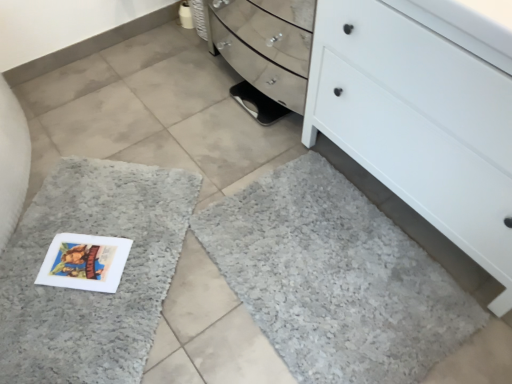
Question: Considering the relative sizes of black rubber shoe at center and gray shaggy bath mat at lower left, marked as the first bath mat in a left-to-right arrangement, in the image provided, is black rubber shoe at center taller than gray shaggy bath mat at lower left, marked as the first bath mat in a left-to-right arrangement,?

Choices:
 (A) no
 (B) yes

Answer: (A)

Question: Does black rubber shoe at center appear on the left side of gray shaggy bath mat at lower left, which is the second bath mat from right to left?

Choices:
 (A) no
 (B) yes

Answer: (A)

Question: Does black rubber shoe at center have a smaller size compared to gray shaggy bath mat at lower left, marked as the first bath mat in a left-to-right arrangement?

Choices:
 (A) no
 (B) yes

Answer: (B)

Question: Is black rubber shoe at center oriented towards gray shaggy bath mat at lower left, marked as the first bath mat in a left-to-right arrangement?

Choices:
 (A) yes
 (B) no

Answer: (A)

Question: Are black rubber shoe at center and gray shaggy bath mat at lower left, marked as the first bath mat in a left-to-right arrangement, making contact?

Choices:
 (A) yes
 (B) no

Answer: (B)

Question: Can we say black rubber shoe at center lies outside gray shaggy bath mat at lower left, marked as the first bath mat in a left-to-right arrangement?

Choices:
 (A) no
 (B) yes

Answer: (B)

Question: Is black rubber shoe at center far from white matte chest of drawers at lower right?

Choices:
 (A) yes
 (B) no

Answer: (B)

Question: Is black rubber shoe at center oriented away from white matte chest of drawers at lower right?

Choices:
 (A) yes
 (B) no

Answer: (B)

Question: Does black rubber shoe at center come behind white matte chest of drawers at lower right?

Choices:
 (A) no
 (B) yes

Answer: (B)

Question: Considering the relative sizes of black rubber shoe at center and white matte chest of drawers at lower right in the image provided, is black rubber shoe at center shorter than white matte chest of drawers at lower right?

Choices:
 (A) no
 (B) yes

Answer: (B)

Question: From a real-world perspective, does black rubber shoe at center sit lower than white matte chest of drawers at lower right?

Choices:
 (A) no
 (B) yes

Answer: (B)

Question: Is black rubber shoe at center to the right of white matte chest of drawers at lower right from the viewer's perspective?

Choices:
 (A) yes
 (B) no

Answer: (B)

Question: Is gray shaggy bath mat at lower right, the second bath mat when ordered from left to right, completely or partially outside of white matte chest of drawers at lower right?

Choices:
 (A) no
 (B) yes

Answer: (B)